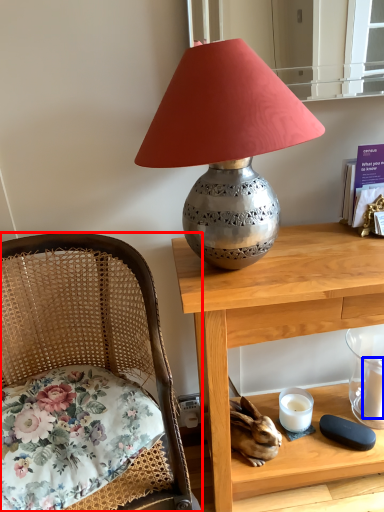
Question: Which of the following is the farthest to the observer, chair (highlighted by a red box) or candle (highlighted by a blue box)?

Choices:
 (A) chair
 (B) candle

Answer: (B)